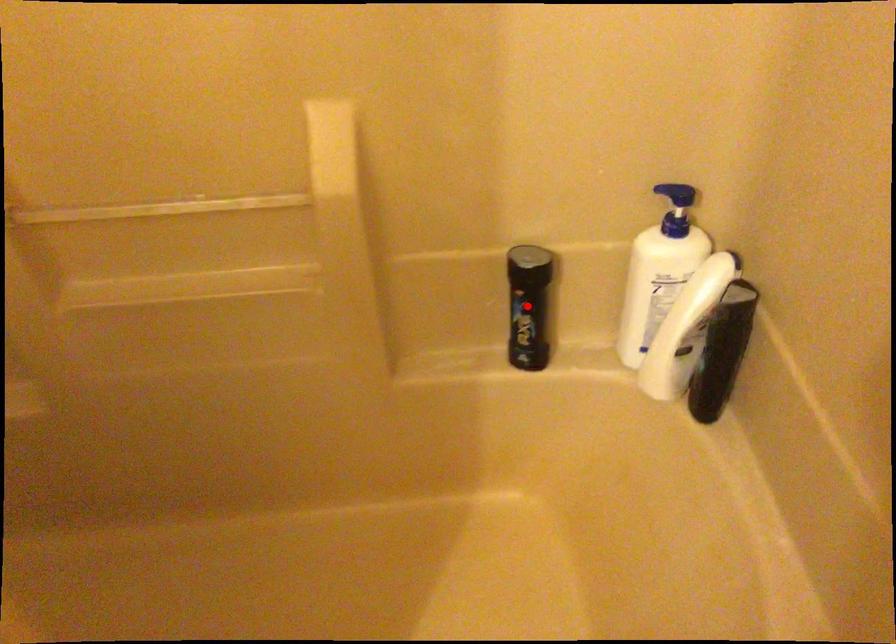
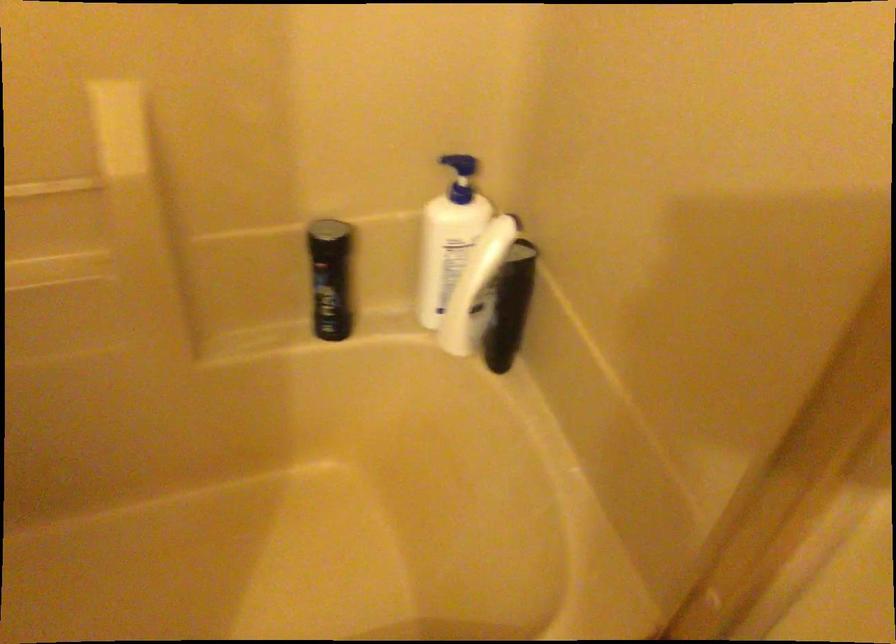
Locate, in the second image, the point that corresponds to the highlighted location in the first image.

(330, 278)